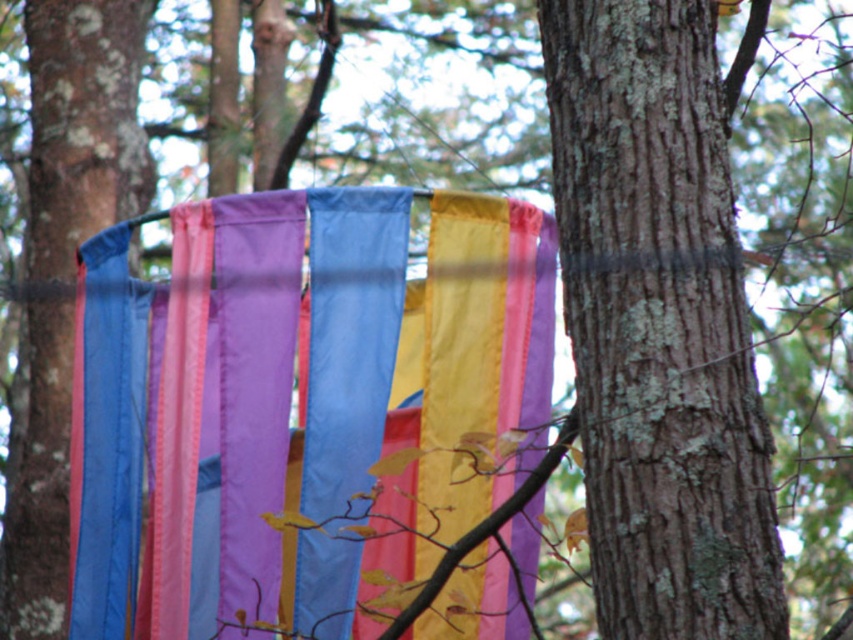
You are standing in the forest looking at the colorful fabric strips between the trees. There are two points marked on the image. Which point is closer to you, point at (328,202) or point at (94,100)?

Point at (328,202) is in front of point at (94,100), so it is closer to you.

You are standing in the forest and see two trees, the smooth bark tree trunk at center and the smooth bark tree trunk at left. Which tree is closer to the ground?

The smooth bark tree trunk at center is closer to the ground because it is positioned below the smooth bark tree trunk at left.

You are standing in the forest and want to take a photo of the smooth bark tree trunk at center. Where should you position yourself to capture it in the frame?

The smooth bark tree trunk at center is located at point (660,321), so you should position yourself directly in front of it to capture it in the frame.